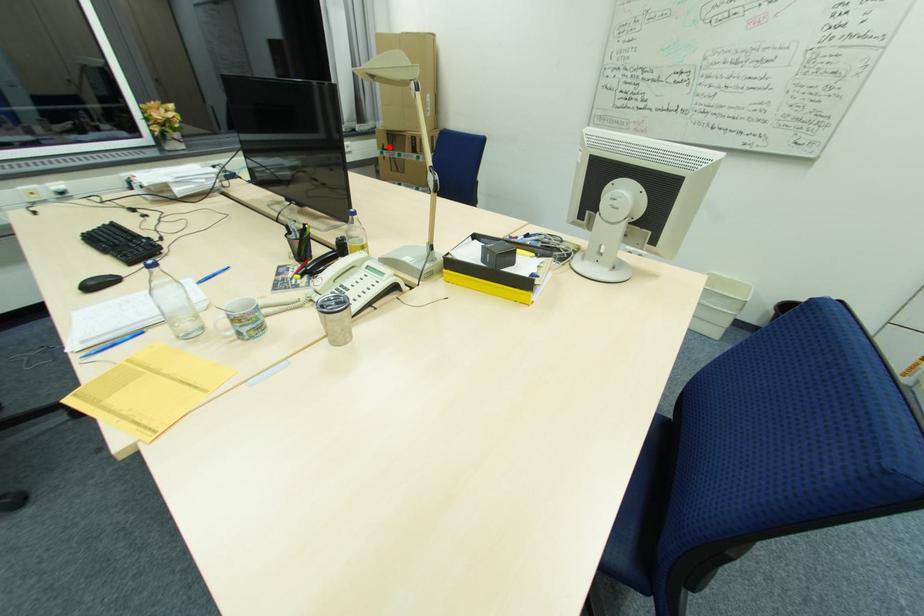
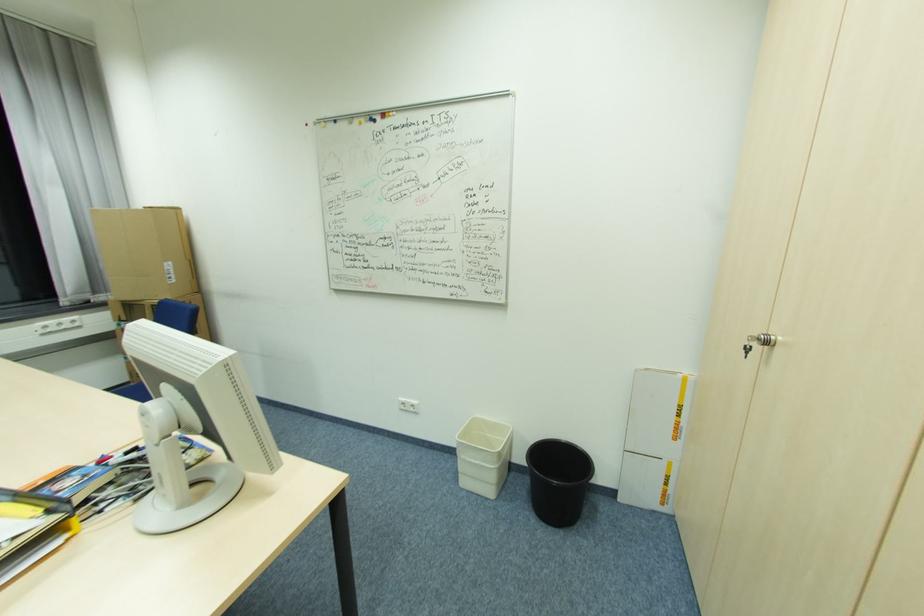
Find the pixel in the second image that matches the highlighted location in the first image.

(127, 318)